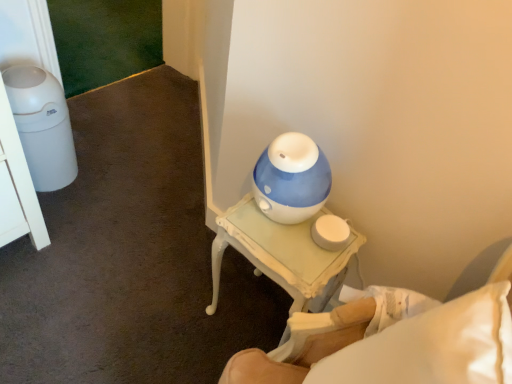
Identify the location of vacant region above white painted wood table at center (from a real-world perspective). (282, 236).